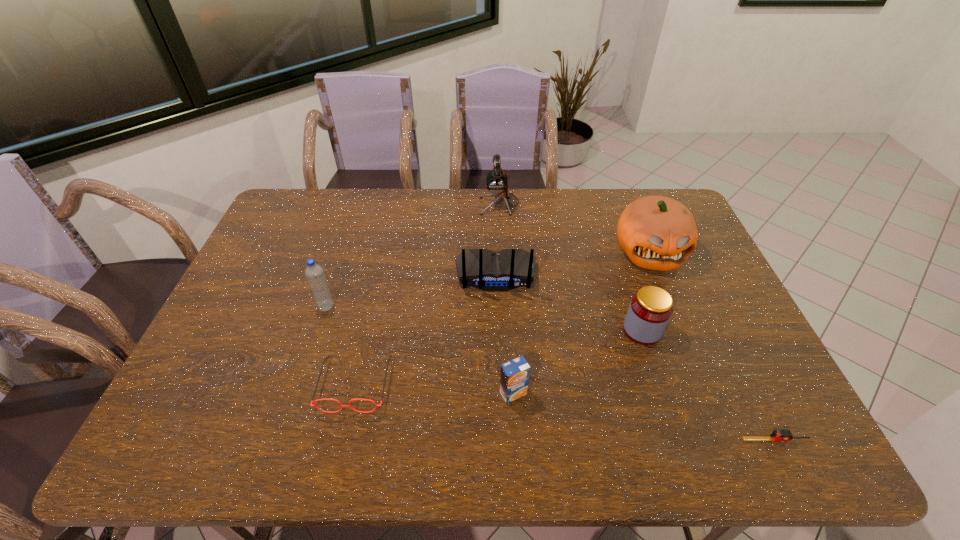
Find the location of `blank space at the near right corner`. blank space at the near right corner is located at coordinates (807, 438).

The image size is (960, 540). I want to click on vacant region between the router and the leftmost object, so click(411, 290).

What are the coordinates of `free space between the tape measure and the router` in the screenshot? It's located at (636, 357).

Where is `vacant region between the fifth nearest object and the shortest object`? The height and width of the screenshot is (540, 960). vacant region between the fifth nearest object and the shortest object is located at coordinates (551, 373).

Locate an element on the screen. empty space that is in between the pumpkin and the router is located at coordinates (572, 262).

At what (x,y) coordinates should I click in order to perform the action: click on vacant space that is in between the router and the sixth tallest object. Please return your answer as a coordinate pair (x, y). The width and height of the screenshot is (960, 540). Looking at the image, I should click on (504, 334).

Where is `vacant point located between the second shortest object and the pumpkin`? vacant point located between the second shortest object and the pumpkin is located at coordinates (502, 318).

This screenshot has height=540, width=960. I want to click on vacant area that lies between the fourth nearest object and the router, so coord(569,302).

Locate an element on the screen. The width and height of the screenshot is (960, 540). free point between the second object from left to right and the router is located at coordinates (425, 329).

The image size is (960, 540). In order to click on free space between the shortest object and the router in this screenshot , I will do `click(636, 357)`.